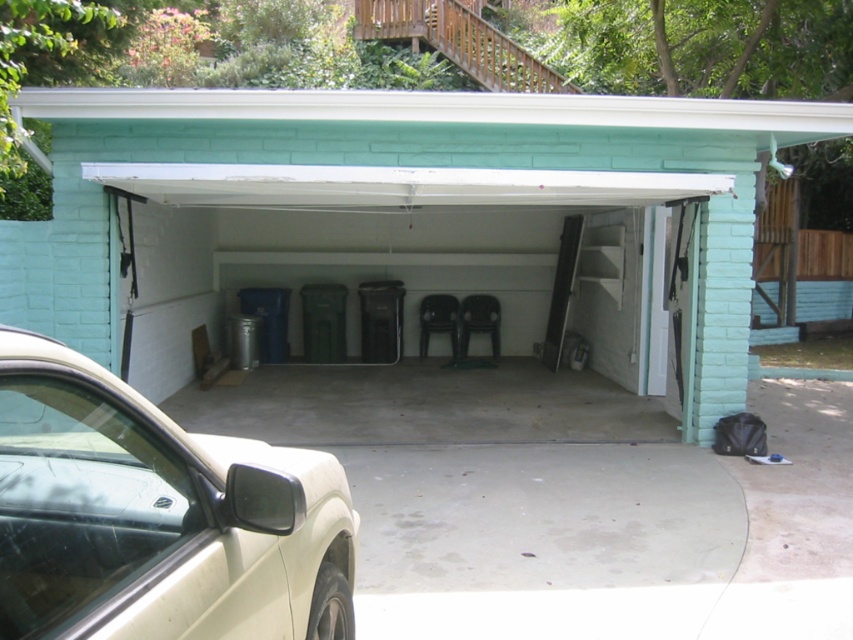
You are standing at the entrance of the garage and want to place a new red trash bin exactly where the white plastic chairs at center are currently located. Is this possible? Please explain your reasoning based on the scene description.

The white plastic chairs at center are located at point (407, 221). Since there are already chairs at that position, placing a new red trash bin there would require moving the existing chairs first.

You are standing at the entrance of the garage and want to move towards the beige matte car at lower left. Are the white plastic chairs at center blocking your path?

The white plastic chairs at center are further to the viewer than the beige matte car at lower left, so they are closer to you. This means the white plastic chairs at center are blocking your path to the beige matte car at lower left.

You are a delivery person trying to park your delivery van in the garage. The van is 2 meters wide. You see the white plastic chairs at center and the beige matte car at lower left. Can you fit your van between them?

The white plastic chairs at center is positioned over beige matte car at lower left, so there is no space between them. Therefore, the van cannot fit between them.